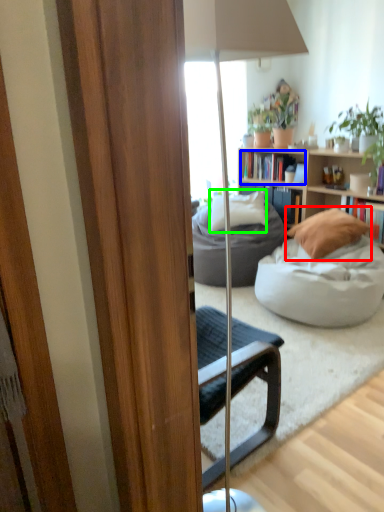
Question: Which object is the closest to the pillow (highlighted by a red box)? Choose among these: book (highlighted by a blue box) or pillow (highlighted by a green box).

Choices:
 (A) book
 (B) pillow

Answer: (B)